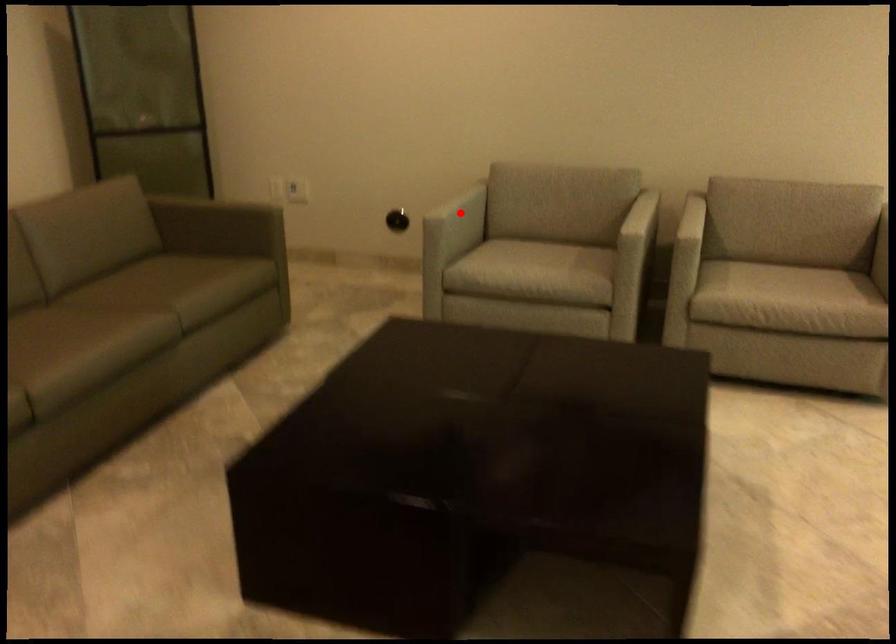
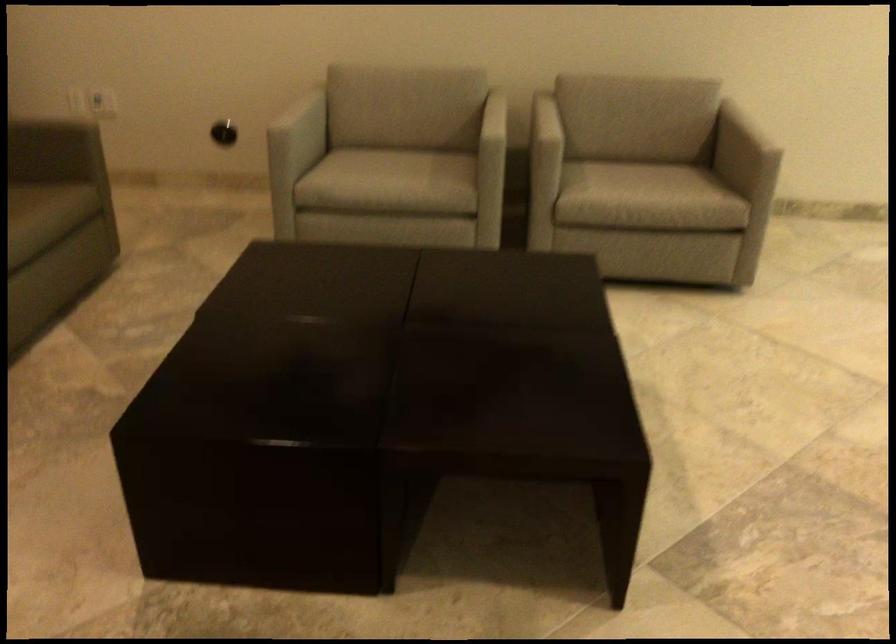
The point at the highlighted location is marked in the first image. Where is the corresponding point in the second image?

(304, 124)